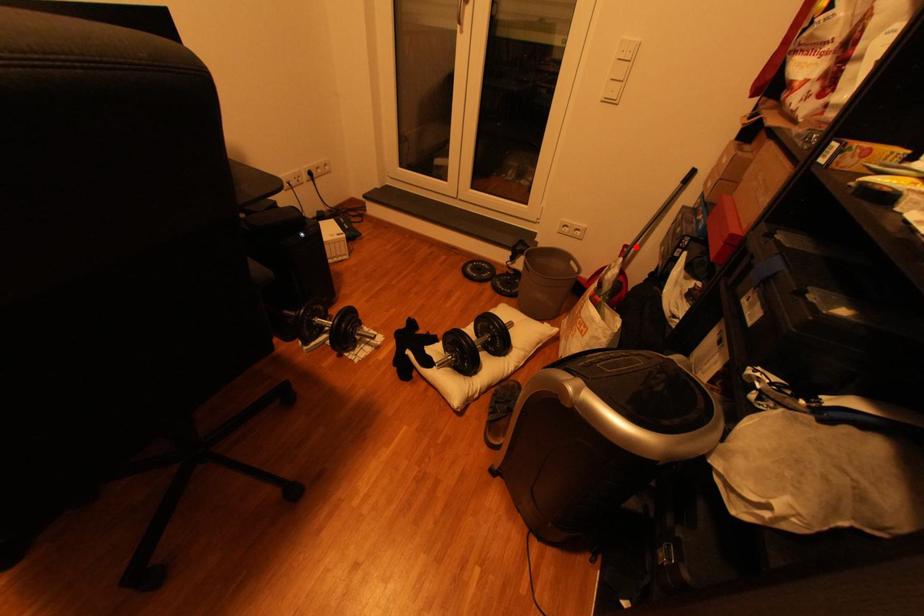
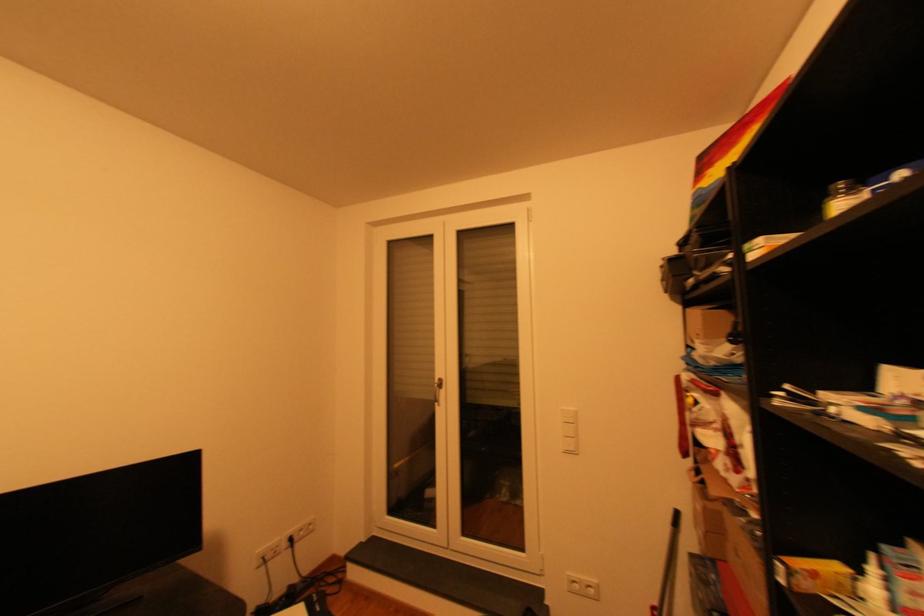
Question: I am providing you with two images of the same scene from different viewpoints. Image1 has a red point marked. In image2, the corresponding 3D location appears at what relative position? Reply with the corresponding letter.

Choices:
 (A) Closer
 (B) Farther

Answer: (A)